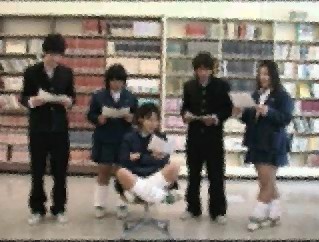
At what (x,y) coordinates should I click in order to perform the action: click on book shelves. Please return your answer as a coordinate pair (x, y). The image size is (319, 242). Looking at the image, I should click on (121, 47), (192, 39).